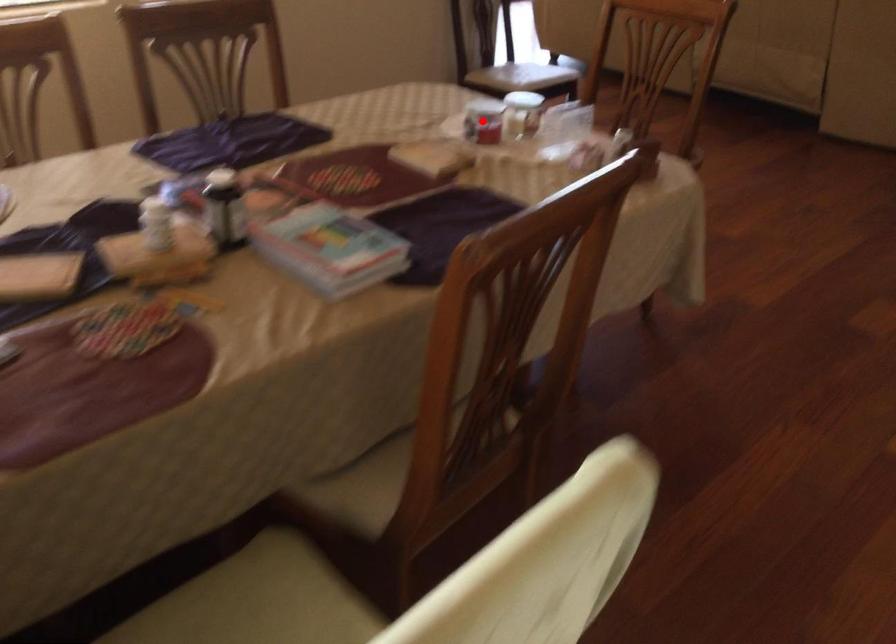
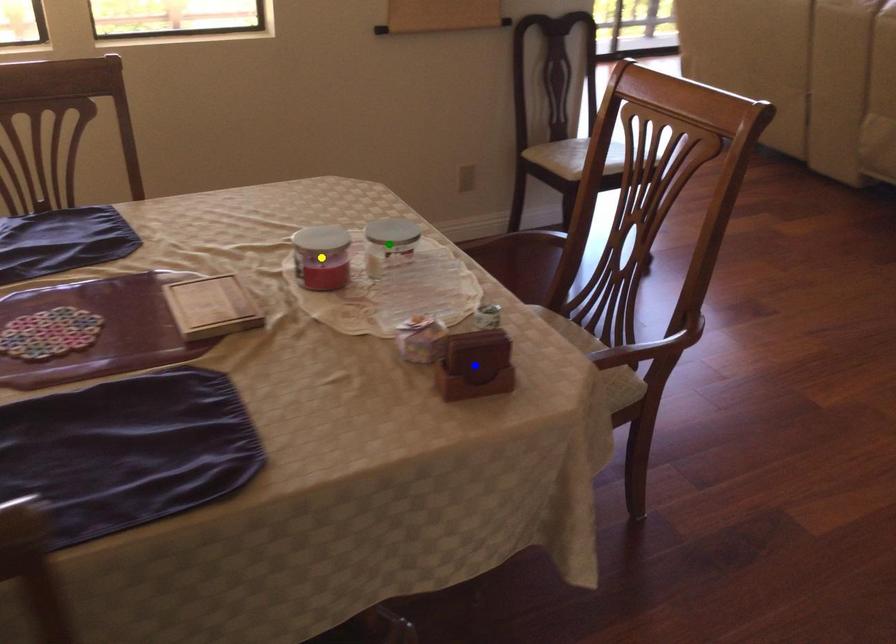
Question: I am providing you with two images of the same scene from different viewpoints. A red point is marked on the first image. You are given multiple points on the second image. Which point in image 2 represents the same 3d spot as the red point in image 1?

Choices:
 (A) green point
 (B) yellow point
 (C) blue point

Answer: (B)